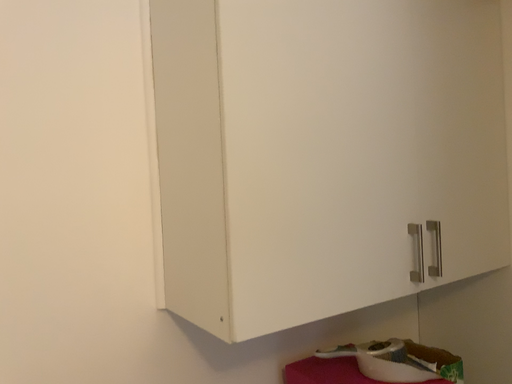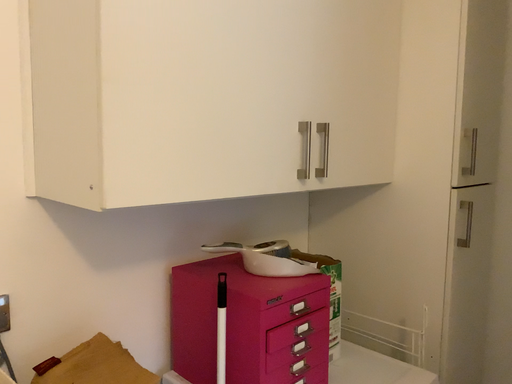
Question: How did the camera likely rotate when shooting the video?

Choices:
 (A) rotated left
 (B) rotated right

Answer: (B)